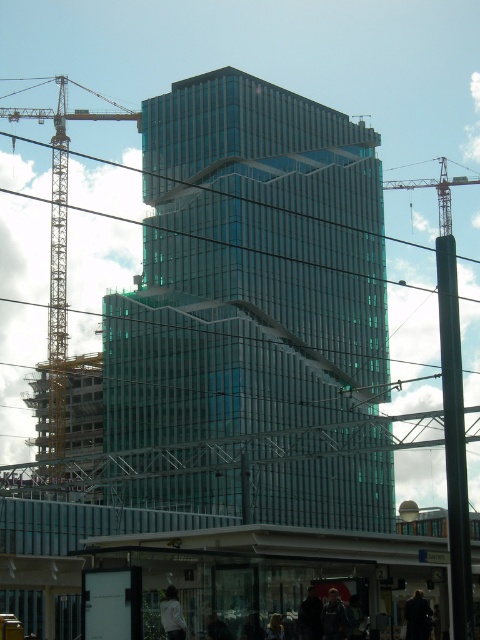
Can you confirm if dark brown leather coat at lower center is shorter than white matte jacket at lower center?

No.

Between dark brown leather coat at lower center and white matte jacket at lower center, which one appears on the left side from the viewer's perspective?

white matte jacket at lower center

Find the location of a particular element. This screenshot has width=480, height=640. dark brown leather coat at lower center is located at coordinates (418, 616).

Locate an element on the screen. dark brown leather coat at lower center is located at coordinates (418, 616).

At what (x,y) coordinates should I click in order to perform the action: click on transparent glass building at center. Please return your answer as a coordinate pair (x, y). This screenshot has width=480, height=640. Looking at the image, I should click on (254, 308).

How distant is transparent glass building at center from dark brown leather coat at lower center?

transparent glass building at center and dark brown leather coat at lower center are 429.50 feet apart from each other.

The height and width of the screenshot is (640, 480). What do you see at coordinates (254, 308) in the screenshot? I see `transparent glass building at center` at bounding box center [254, 308].

The image size is (480, 640). Identify the location of transparent glass building at center. (254, 308).

Can you confirm if metallic gray crane at upper right is positioned to the left of dark brown leather coat at lower center?

In fact, metallic gray crane at upper right is to the right of dark brown leather coat at lower center.

Who is taller, metallic gray crane at upper right or dark brown leather coat at lower center?

metallic gray crane at upper right is taller.

Who is more distant from viewer, (x=444, y=198) or (x=408, y=609)?

Point (x=444, y=198)

What are the coordinates of `metallic gray crane at upper right` in the screenshot? It's located at (436, 192).